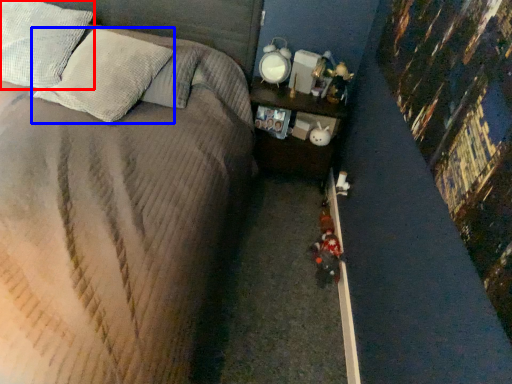
Question: Which object is further to the camera taking this photo, pillow (highlighted by a red box) or pillow (highlighted by a blue box)?

Choices:
 (A) pillow
 (B) pillow

Answer: (A)